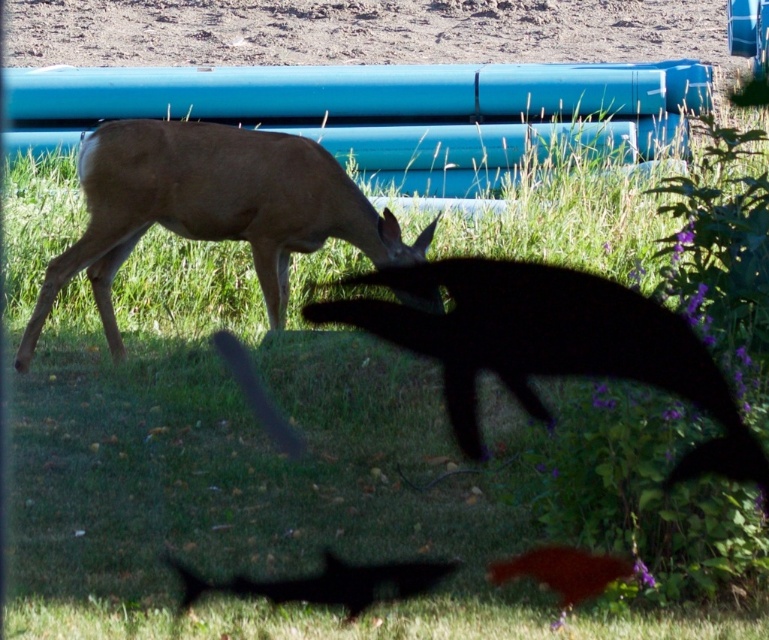
Is black matte dog at center smaller than brown matte deer at center?

Actually, black matte dog at center might be larger than brown matte deer at center.

Which is in front, point (455, 403) or point (318, 195)?

Point (455, 403) is in front.

Find the location of a particular element. This screenshot has height=640, width=769. black matte dog at center is located at coordinates (551, 346).

Is brown matte deer at center to the right of black matte deer at lower center from the viewer's perspective?

In fact, brown matte deer at center is to the left of black matte deer at lower center.

Does point (138, 173) come in front of point (321, 580)?

No, it is behind (321, 580).

You are a GUI agent. You are given a task and a screenshot of the screen. Output one action in this format:
    pyautogui.click(x=<x>, y=<y>)
    Task: Click on the brown matte deer at center
    This screenshot has height=640, width=769.
    Given the screenshot: What is the action you would take?
    pyautogui.click(x=212, y=209)

Who is positioned more to the left, black matte dog at center or black matte deer at lower center?

black matte deer at lower center is more to the left.

Is black matte dog at center wider than black matte deer at lower center?

Yes, black matte dog at center is wider than black matte deer at lower center.

Between point (541, 420) and point (415, 593), which one is positioned in front?

Point (415, 593) is in front.

You are a GUI agent. You are given a task and a screenshot of the screen. Output one action in this format:
    pyautogui.click(x=<x>, y=<y>)
    Task: Click on the black matte dog at center
    
    Given the screenshot: What is the action you would take?
    pyautogui.click(x=551, y=346)